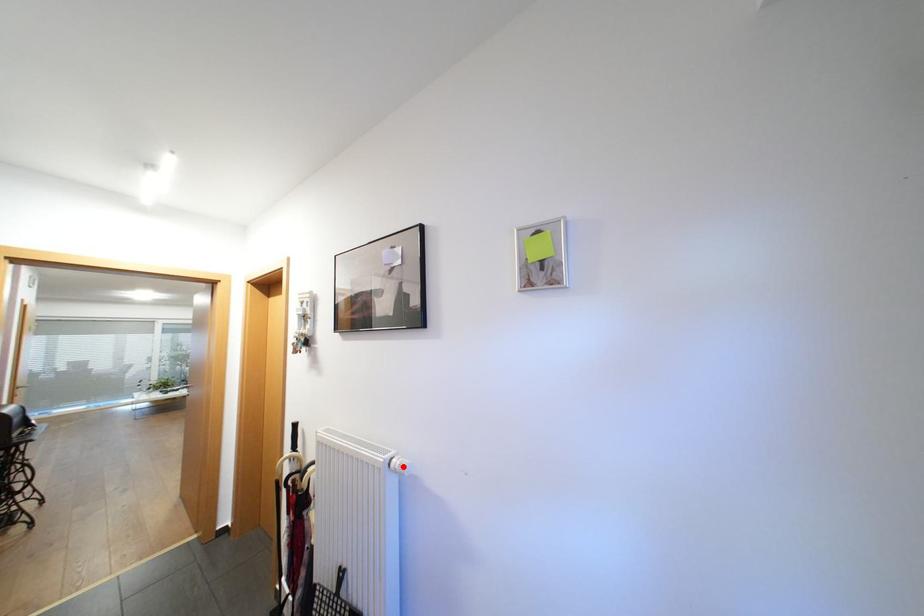
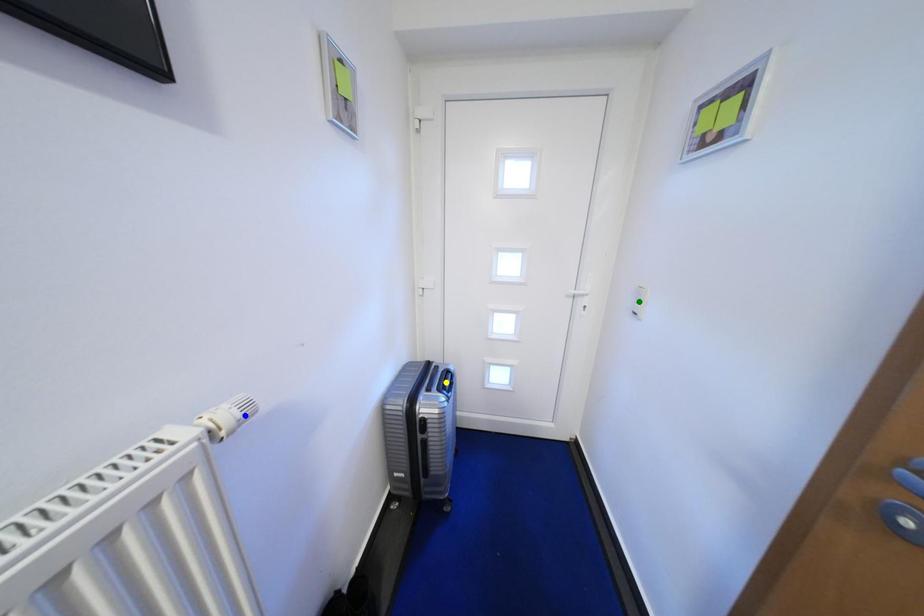
Question: I am providing you with two images of the same scene from different viewpoints. A red point is marked on the first image. You are given multiple points on the second image. Which point in image 2 is actually the same real-world point as the red point in image 1?

Choices:
 (A) yellow point
 (B) green point
 (C) blue point

Answer: (C)